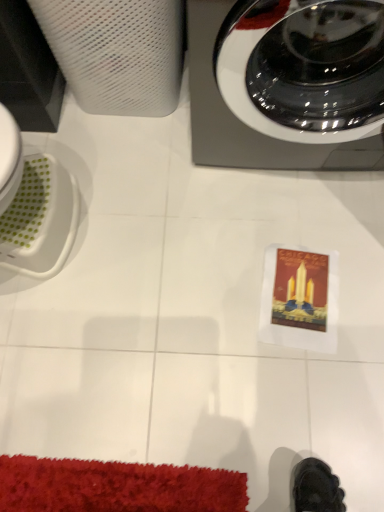
Locate an element on the screen. vacant area in front of white mesh paper towel at upper left is located at coordinates (128, 165).